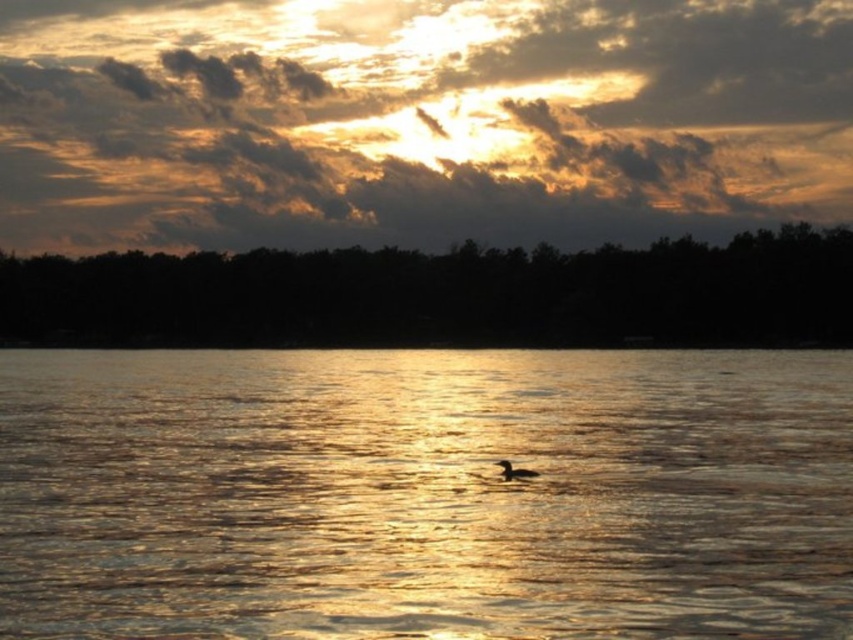
Is the position of golden textured clouds at upper center more distant than that of brown matte duck at center?

Yes, golden textured clouds at upper center is behind brown matte duck at center.

Which is below, golden textured clouds at upper center or brown matte duck at center?

brown matte duck at center is lower down.

Is point (590, 228) positioned before point (515, 474)?

No, (590, 228) is further to viewer.

At what (x,y) coordinates should I click in order to perform the action: click on golden textured clouds at upper center. Please return your answer as a coordinate pair (x, y). Looking at the image, I should click on (416, 120).

Describe the element at coordinates (425, 493) in the screenshot. This screenshot has width=853, height=640. I see `glistening water at center` at that location.

Between point (524, 424) and point (325, 152), which one is positioned in front?

Point (524, 424) is more forward.

Who is more forward, (842, 515) or (218, 204)?

Point (842, 515) is more forward.

I want to click on glistening water at center, so click(425, 493).

Is point (766, 403) positioned behind point (500, 467)?

Yes, point (766, 403) is farther from viewer.

Measure the distance from glistening water at center to brown matte duck at center.

30.09 meters

Who is more distant from viewer, (793,396) or (495,461)?

The point (793,396) is more distant.

Where is `glistening water at center`? glistening water at center is located at coordinates (425, 493).